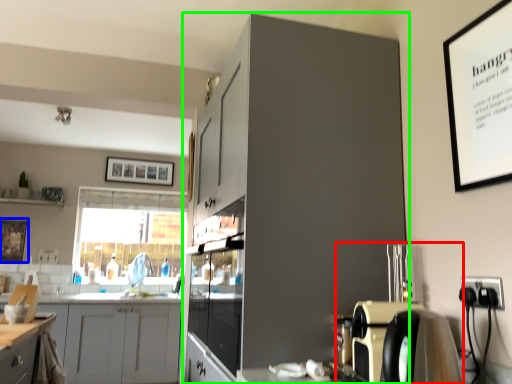
Question: Which object is positioned farthest from coffee machine (highlighted by a red box)? Select from picture frame (highlighted by a blue box) and cabinetry (highlighted by a green box).

Choices:
 (A) picture frame
 (B) cabinetry

Answer: (A)